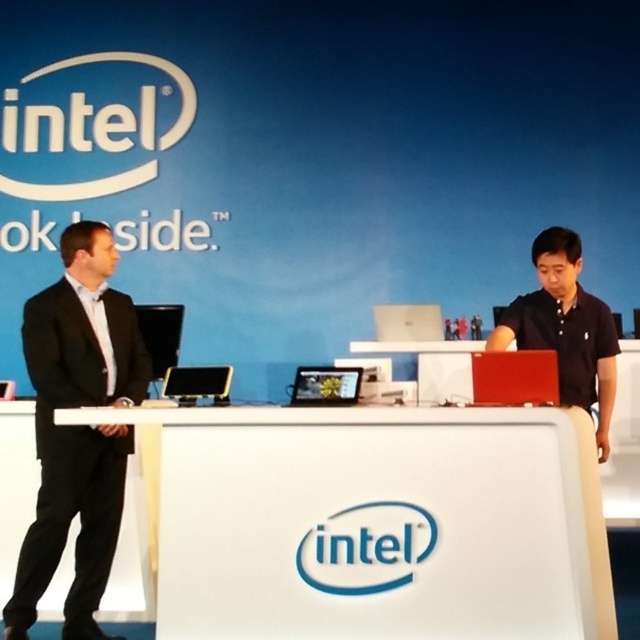
In the scene shown: You are setting up a promotional booth and need to place a large banner on the white plastic information desk at center or the matte black shirt at center. Which object can accommodate the banner based on size?

The white plastic information desk at center is bigger than the matte black shirt at center, so the banner can be placed on the white plastic information desk at center.

You are a photographer at the event and need to capture a clear photo of the white glossy table at center. However, there is a person wearing a matte black shirt at center blocking your view. Based on their relative sizes, can you suggest a way to position yourself to avoid the obstruction?

The matte black shirt at center is much taller than the white glossy table at center, so positioning yourself lower or crouching might allow you to capture the table without the person blocking the view.

In the scene shown: You are at the Intel booth and need to place a promotional brochure on the white plastic information desk at center. Where should you place it in relation to the matte black shirt at center?

You should place the promotional brochure on the white plastic information desk at center to the left of the matte black shirt at center.